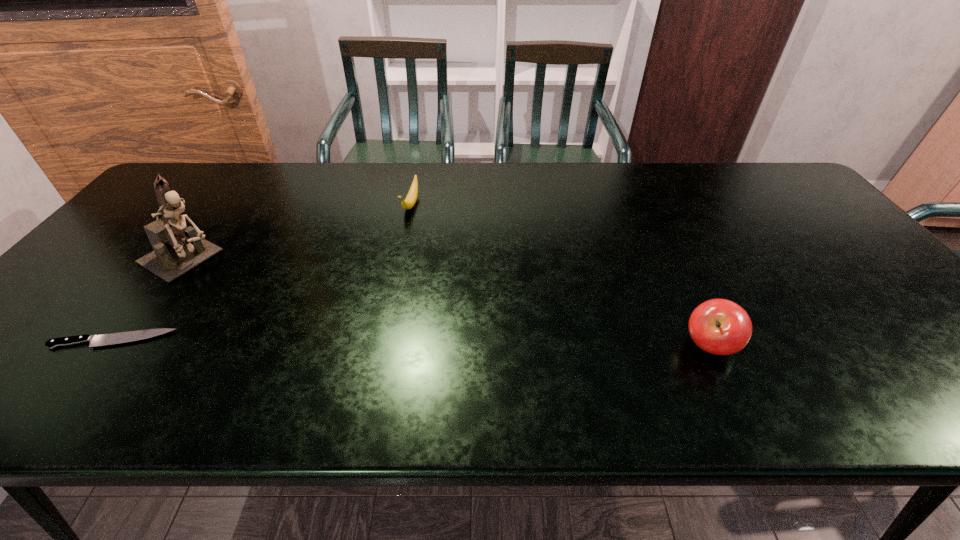
Identify the location of free space on the desktop that is between the steak knife and the third shortest object and is positioned on the front-facing side of the figurine. This screenshot has height=540, width=960. (337, 342).

The height and width of the screenshot is (540, 960). I want to click on vacant space on the desktop that is between the shortest object and the third shortest object and is positioned at the stem of the farthest object, so point(351,342).